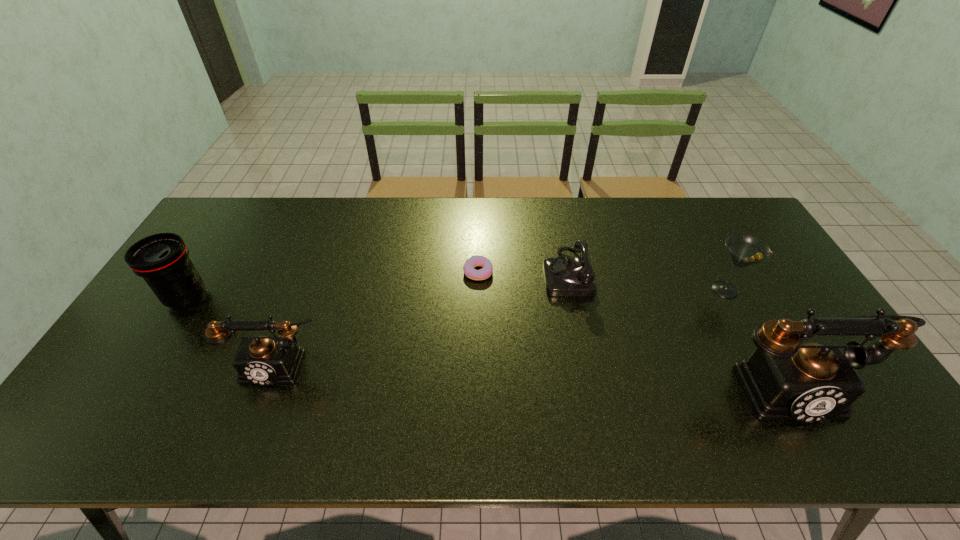
You are a GUI agent. You are given a task and a screenshot of the screen. Output one action in this format:
    pyautogui.click(x=<x>, y=<y>)
    Task: Click on the free space located on the front of the shortest object
    
    Given the screenshot: What is the action you would take?
    pyautogui.click(x=477, y=363)

Locate an element on the screen. free region located 0.160m on the back of the martini is located at coordinates (699, 242).

Locate an element on the screen. free space located on the dial of the second telephone from left to right is located at coordinates (501, 272).

The image size is (960, 540). What are the coordinates of `vacant space situated on the dial of the second telephone from left to right` in the screenshot? It's located at (486, 272).

This screenshot has height=540, width=960. I want to click on blank area located 0.280m on the dial of the second telephone from left to right, so click(x=453, y=272).

Locate an element on the screen. free space located 0.370m on the right of the leftmost object is located at coordinates (336, 298).

You are a GUI agent. You are given a task and a screenshot of the screen. Output one action in this format:
    pyautogui.click(x=<x>, y=<y>)
    Task: Click on the object that is at the left edge
    This screenshot has height=540, width=960.
    Given the screenshot: What is the action you would take?
    pyautogui.click(x=162, y=259)

Image resolution: width=960 pixels, height=540 pixels. I want to click on telephone at the right edge, so click(784, 379).

Where is `martini that is at the right edge`? martini that is at the right edge is located at coordinates (745, 250).

The image size is (960, 540). I want to click on object positioned at the near right corner, so click(x=784, y=379).